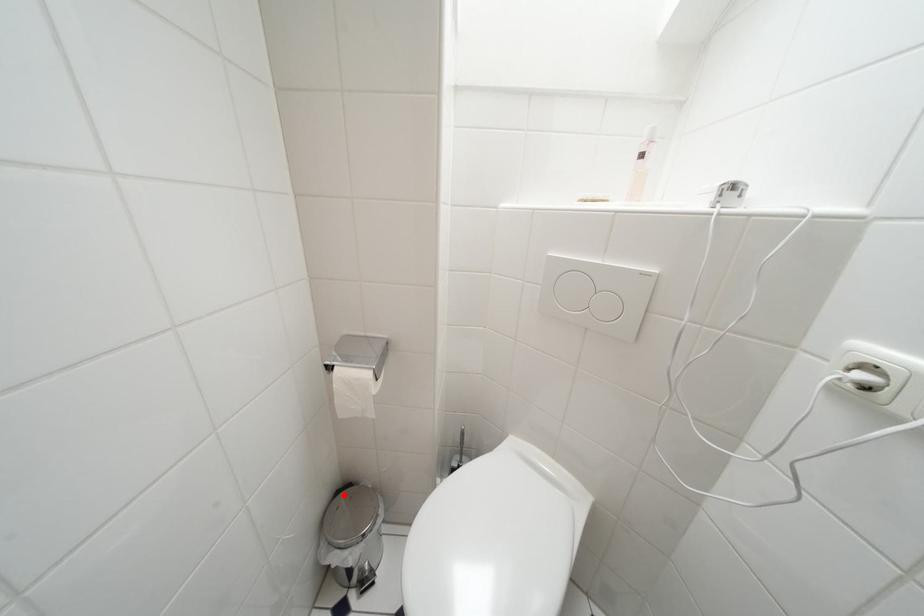
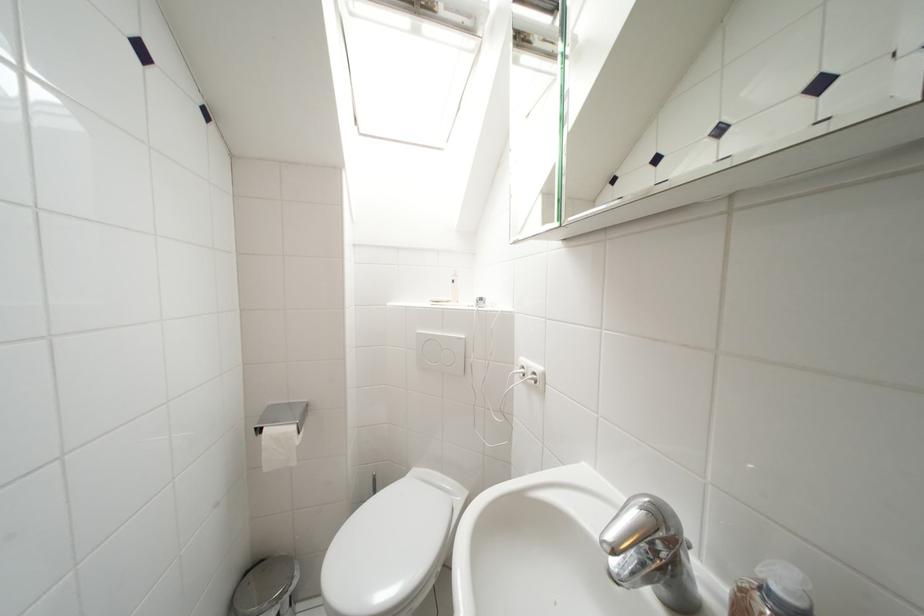
Question: I am providing you with two images of the same scene from different viewpoints. A red point is marked on the first image. Can you still see the location of the red point in image 2?

Choices:
 (A) Yes
 (B) No

Answer: (A)